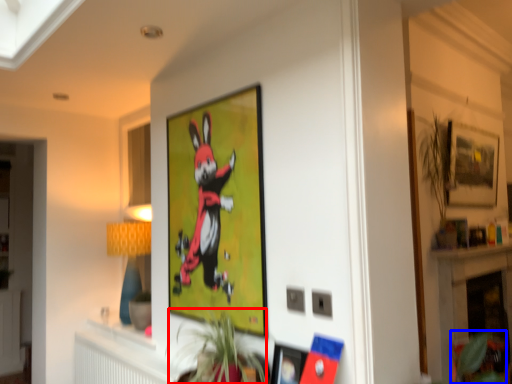
Question: Which of the following is the closest to the observer, plant (highlighted by a red box) or plant (highlighted by a blue box)?

Choices:
 (A) plant
 (B) plant

Answer: (A)